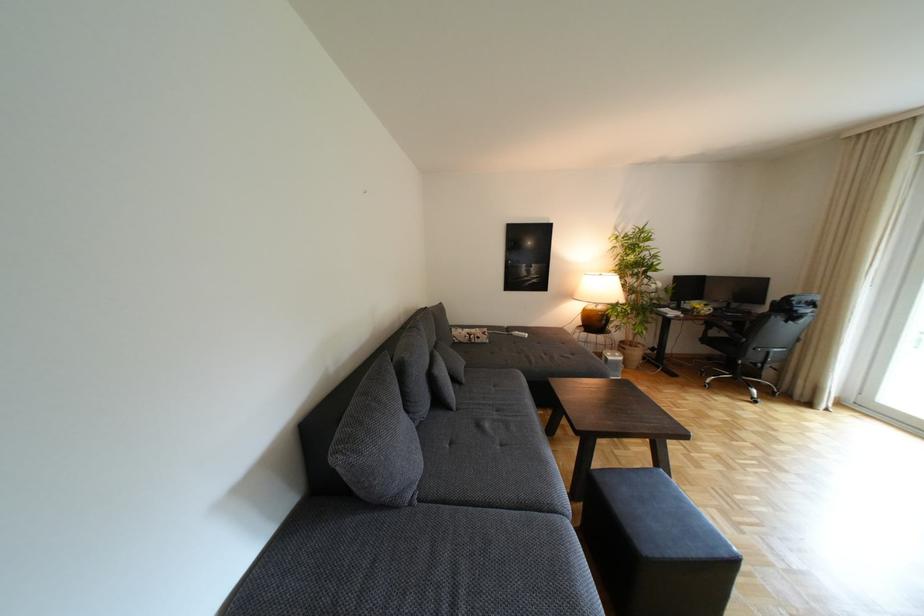
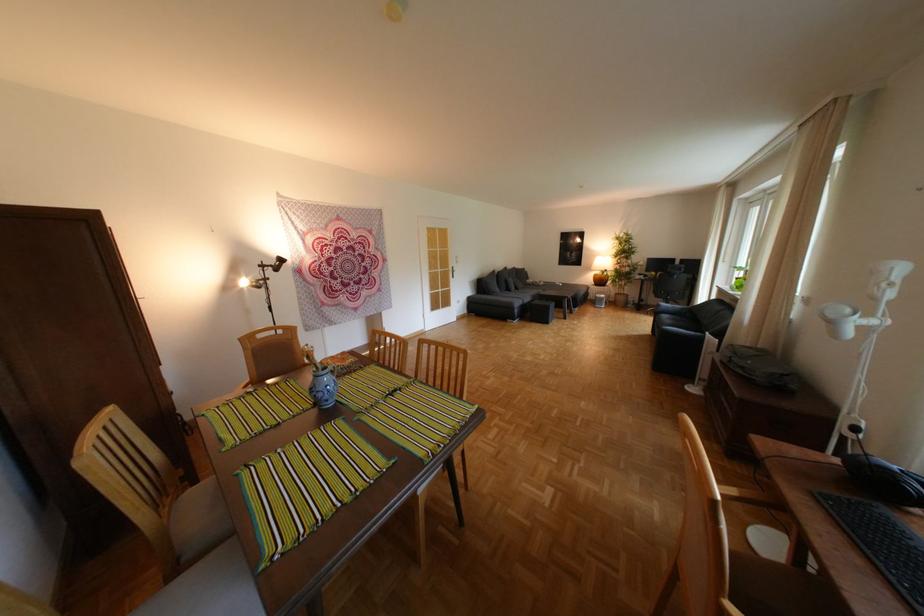
The point at (625, 264) is marked in the first image. Where is the corresponding point in the second image?

(626, 252)